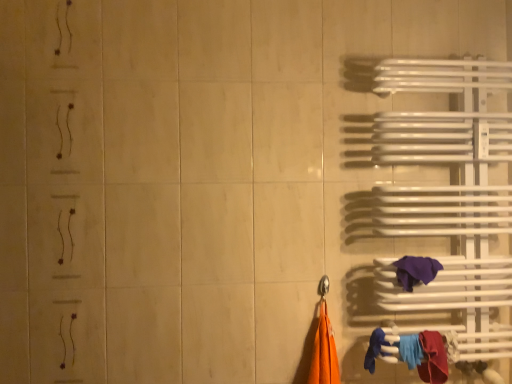
Question: Does point (398, 261) appear closer or farther from the camera than point (435, 360)?

Choices:
 (A) closer
 (B) farther

Answer: (B)

Question: Is purple fabric towel at right, acting as the second towel starting from the bottom, bigger or smaller than red fabric towel at lower right, the 1th towel ordered from the bottom?

Choices:
 (A) small
 (B) big

Answer: (A)

Question: Is purple fabric towel at right, arranged as the 1th towel when viewed from the top, spatially inside red fabric towel at lower right, which is the 2th towel in top-to-bottom order, or outside of it?

Choices:
 (A) inside
 (B) outside

Answer: (B)

Question: From a real-world perspective, relative to purple fabric towel at right, acting as the second towel starting from the bottom, is red fabric towel at lower right, the 1th towel ordered from the bottom, vertically above or below?

Choices:
 (A) above
 (B) below

Answer: (B)

Question: Does point (430, 377) appear closer or farther from the camera than point (423, 271)?

Choices:
 (A) farther
 (B) closer

Answer: (B)

Question: In terms of width, does red fabric towel at lower right, which is the 2th towel in top-to-bottom order, look wider or thinner when compared to purple fabric towel at right, acting as the second towel starting from the bottom?

Choices:
 (A) wide
 (B) thin

Answer: (A)

Question: In terms of size, does red fabric towel at lower right, the 1th towel ordered from the bottom, appear bigger or smaller than purple fabric towel at right, acting as the second towel starting from the bottom?

Choices:
 (A) big
 (B) small

Answer: (A)